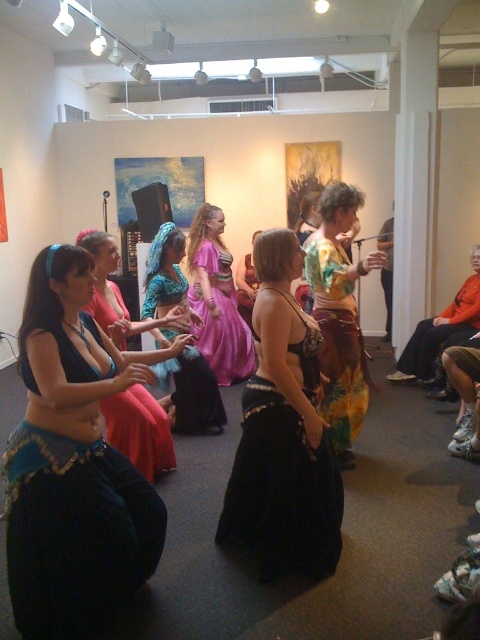
Is floral fabric skirt at center bigger than shiny blue fabric belly dancer at center?

No, floral fabric skirt at center is not bigger than shiny blue fabric belly dancer at center.

Is point (352, 420) less distant than point (196, 378)?

Yes.

Who is more distant from viewer, (377, 260) or (187, 433)?

The point (187, 433) is more distant.

Where is `floral fabric skirt at center`? The width and height of the screenshot is (480, 640). floral fabric skirt at center is located at coordinates (339, 316).

Is shiny blue fabric at center to the left of orange fabric skirt at right from the viewer's perspective?

Indeed, shiny blue fabric at center is positioned on the left side of orange fabric skirt at right.

Who is shorter, shiny blue fabric at center or orange fabric skirt at right?

With less height is shiny blue fabric at center.

Describe the element at coordinates (140, 429) in the screenshot. The image size is (480, 640). I see `shiny blue fabric at center` at that location.

Identify the location of shiny blue fabric at center. The width and height of the screenshot is (480, 640). (140, 429).

Does blue satin belly dancer at center have a smaller size compared to shiny blue fabric belly dancer at center?

Yes.

Does blue satin belly dancer at center have a larger size compared to shiny blue fabric belly dancer at center?

No, blue satin belly dancer at center is not bigger than shiny blue fabric belly dancer at center.

Is point (39, 278) closer to camera compared to point (170, 394)?

That is True.

I want to click on blue satin belly dancer at center, so click(x=72, y=467).